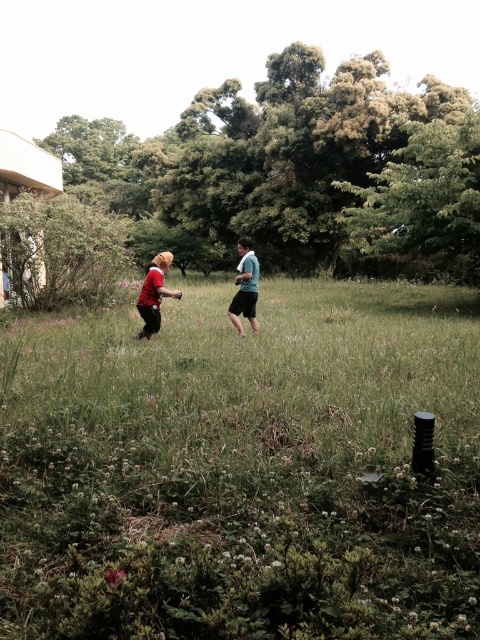
Question: Is green grassy field at center wider than matte red shirt at center?

Choices:
 (A) yes
 (B) no

Answer: (A)

Question: Is green grassy field at center wider than matte red shirt at center?

Choices:
 (A) yes
 (B) no

Answer: (A)

Question: Among these points, which one is nearest to the camera?

Choices:
 (A) (227, 380)
 (B) (253, 305)

Answer: (A)

Question: Can you confirm if green grassy field at center is smaller than matte blue shirt at center?

Choices:
 (A) no
 (B) yes

Answer: (A)

Question: Which object is farther from the camera taking this photo?

Choices:
 (A) matte blue shirt at center
 (B) green grassy field at center

Answer: (A)

Question: Estimate the real-world distances between objects in this image. Which object is farther from the green grassy field at center?

Choices:
 (A) matte blue shirt at center
 (B) matte red shirt at center

Answer: (B)